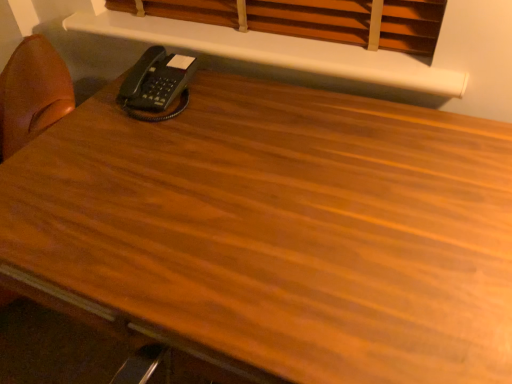
Question: In terms of height, does wooden blinds at upper center look taller or shorter compared to white matte shelf at upper center?

Choices:
 (A) short
 (B) tall

Answer: (B)

Question: Considering the positions of wooden blinds at upper center and white matte shelf at upper center in the image, is wooden blinds at upper center bigger or smaller than white matte shelf at upper center?

Choices:
 (A) small
 (B) big

Answer: (B)

Question: Estimate the real-world distances between objects in this image. Which object is farther from the black plastic phone at upper left?

Choices:
 (A) white matte shelf at upper center
 (B) wooden blinds at upper center

Answer: (B)

Question: Which is farther from the white matte shelf at upper center?

Choices:
 (A) wooden blinds at upper center
 (B) black plastic phone at upper left

Answer: (B)